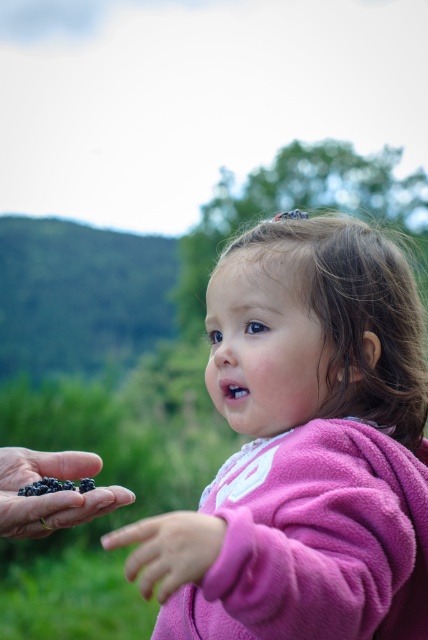
Between point (279, 460) and point (94, 493), which one is positioned behind?

The point (279, 460) is more distant.

Which is above, pink fleece jacket at center or black matte berries at lower left?

pink fleece jacket at center

In order to click on pink fleece jacket at center in this screenshot , I will do `click(303, 449)`.

The image size is (428, 640). In order to click on pink fleece jacket at center in this screenshot , I will do `click(303, 449)`.

Does black matte berries at lower left have a smaller size compared to pink fleece hand at lower center?

Incorrect, black matte berries at lower left is not smaller in size than pink fleece hand at lower center.

Between black matte berries at lower left and pink fleece hand at lower center, which one has less height?

With less height is black matte berries at lower left.

Which is in front, point (12, 538) or point (148, 588)?

Point (148, 588) is more forward.

The width and height of the screenshot is (428, 640). In order to click on black matte berries at lower left in this screenshot , I will do `click(50, 493)`.

Does pink fleece hand at lower center have a lesser height compared to blueberry-like berries at lower left?

In fact, pink fleece hand at lower center may be taller than blueberry-like berries at lower left.

Does pink fleece hand at lower center appear over blueberry-like berries at lower left?

Actually, pink fleece hand at lower center is below blueberry-like berries at lower left.

What do you see at coordinates (169, 548) in the screenshot?
I see `pink fleece hand at lower center` at bounding box center [169, 548].

You are a GUI agent. You are given a task and a screenshot of the screen. Output one action in this format:
    pyautogui.click(x=<x>, y=<y>)
    Task: Click on the pink fleece hand at lower center
    The width and height of the screenshot is (428, 640).
    Given the screenshot: What is the action you would take?
    [169, 548]